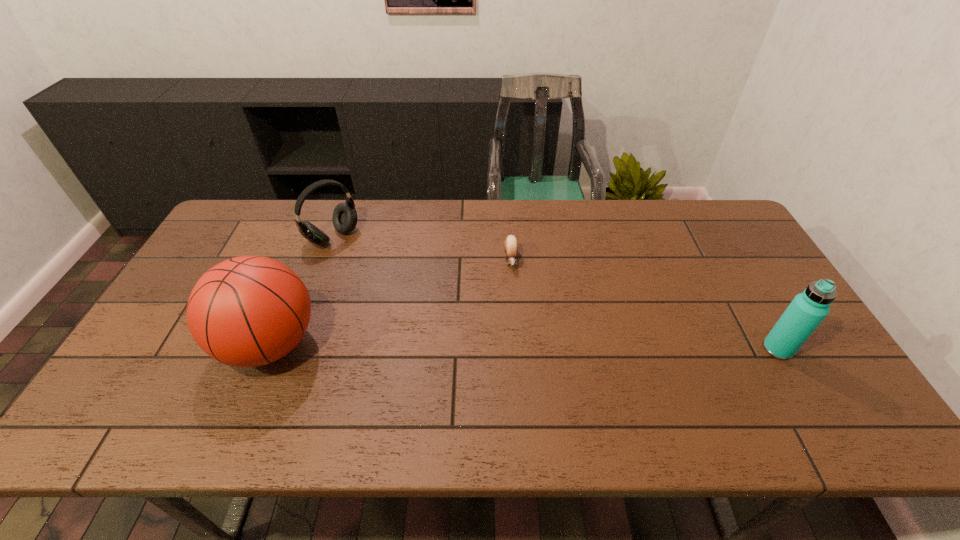
In the image, there is a desktop. Identify the location of vacant region at the near left corner. (142, 386).

Identify the location of blank region between the third object from left to right and the water bottle. (644, 304).

This screenshot has width=960, height=540. What are the coordinates of `free space between the escargot and the third tallest object` in the screenshot? It's located at (422, 248).

I want to click on free space between the rightmost object and the second shortest object, so click(555, 293).

Locate an element on the screen. This screenshot has width=960, height=540. vacant region between the escargot and the headset is located at coordinates (422, 248).

Where is `blank region between the water bottle and the second shortest object`? This screenshot has width=960, height=540. blank region between the water bottle and the second shortest object is located at coordinates (555, 293).

At what (x,y) coordinates should I click in order to perform the action: click on free point between the basketball and the water bottle. Please return your answer as a coordinate pair (x, y). The width and height of the screenshot is (960, 540). Looking at the image, I should click on (524, 347).

In order to click on free space between the water bottle and the basketball in this screenshot , I will do 524,347.

You are a GUI agent. You are given a task and a screenshot of the screen. Output one action in this format:
    pyautogui.click(x=<x>, y=<y>)
    Task: Click on the vacant point located between the third tallest object and the second object from right to left
    This screenshot has width=960, height=540.
    Given the screenshot: What is the action you would take?
    pyautogui.click(x=422, y=248)

You are a GUI agent. You are given a task and a screenshot of the screen. Output one action in this format:
    pyautogui.click(x=<x>, y=<y>)
    Task: Click on the object that is the second closest to the third tallest object
    Image resolution: width=960 pixels, height=540 pixels.
    Given the screenshot: What is the action you would take?
    pyautogui.click(x=511, y=244)